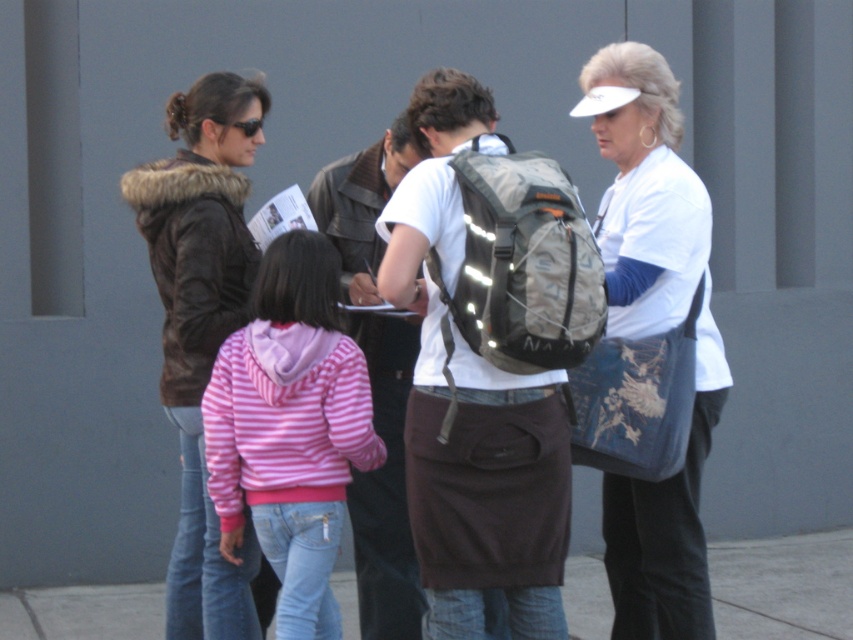
Question: Which object is the closest to the brown fur-lined jacket at left?

Choices:
 (A) white cotton shirt at center
 (B) pink striped hoodie at center
 (C) matte gray backpack at center
 (D) matte black backpack at center

Answer: (B)

Question: Can you confirm if pink striped hoodie at center is bigger than white cotton shirt at center?

Choices:
 (A) no
 (B) yes

Answer: (A)

Question: Considering the relative positions of gray concrete pavement at lower center and white cotton shirt at center in the image provided, where is gray concrete pavement at lower center located with respect to white cotton shirt at center?

Choices:
 (A) above
 (B) below

Answer: (B)

Question: Which point is farther to the camera?

Choices:
 (A) white fabric bag at right
 (B) matte gray backpack at center
 (C) white cotton shirt at center
 (D) brown fur-lined jacket at left

Answer: (C)

Question: Which of these objects is positioned farthest from the gray concrete pavement at lower center?

Choices:
 (A) white cotton shirt at center
 (B) white fabric bag at right

Answer: (A)

Question: Does matte black backpack at center have a lesser width compared to white cotton shirt at center?

Choices:
 (A) yes
 (B) no

Answer: (B)